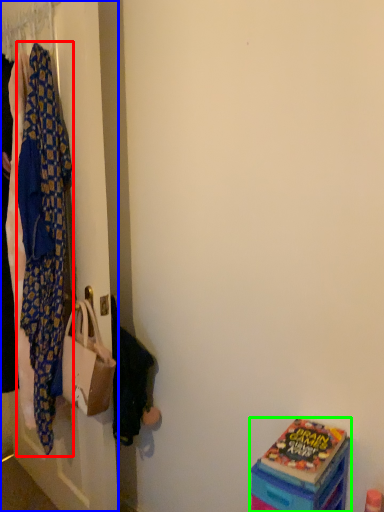
Question: Which is farther away from blanket (highlighted by a red box)? closet (highlighted by a blue box) or box (highlighted by a green box)?

Choices:
 (A) closet
 (B) box

Answer: (B)